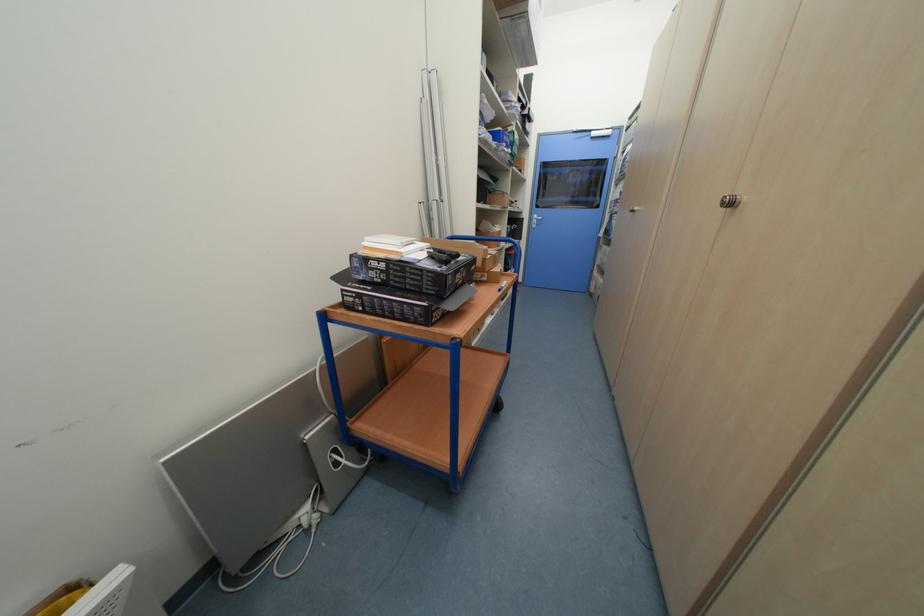
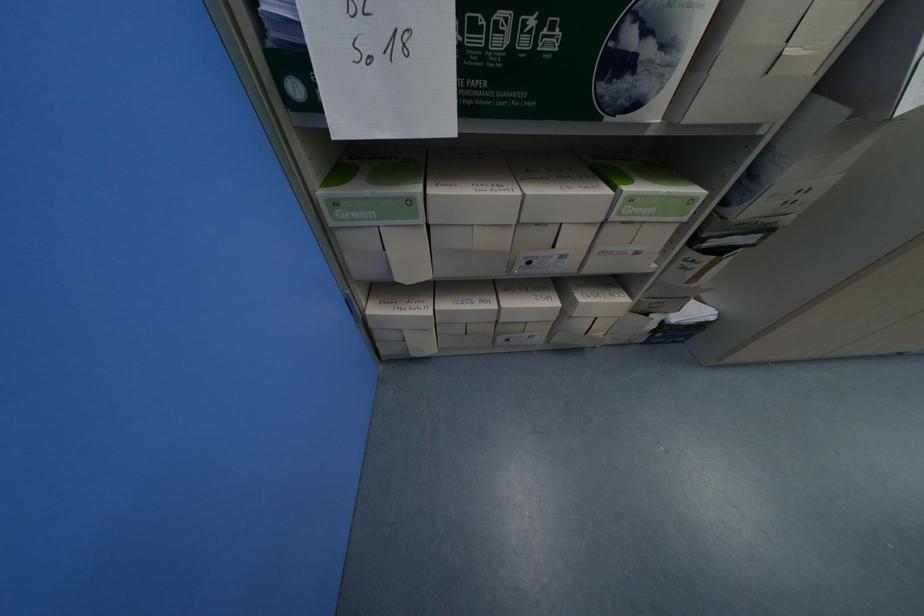
Locate, in the second image, the point that corresponds to point 602,274 in the first image.

(381, 312)